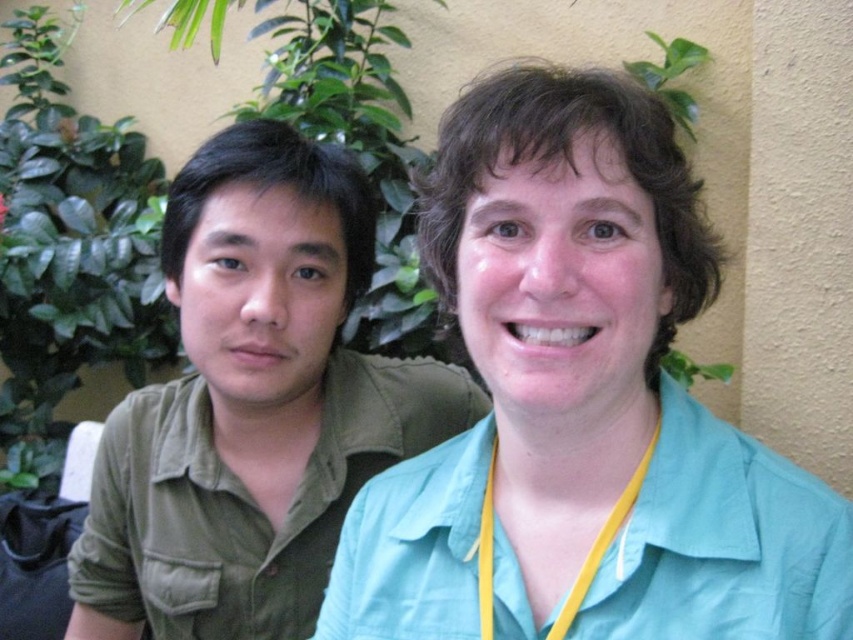
You are trying to find the yellow fabric at center in a photo where two people are standing against a backdrop of greenery and a beige wall. The scene includes a green leafy plant at left. Which object is located to the right of the other?

The green leafy plant at left is positioned on the left side of yellow fabric at center, meaning the yellow fabric at center is to the right of the green leafy plant at left.

You are standing in front of the two people in the image. You notice two points marked in the scene. The first point is at coordinates point (270, 449) and the second is at point (618, 499). Which of these points is closer to you?

Point (270, 449) is closer to you because it is further to the viewer than point (618, 499).

You are standing in front of the image and want to locate the green leafy plant at left. According to the coordinates given, where would you find it?

The green leafy plant at left is located at the 2D coordinates of point (68, 252).